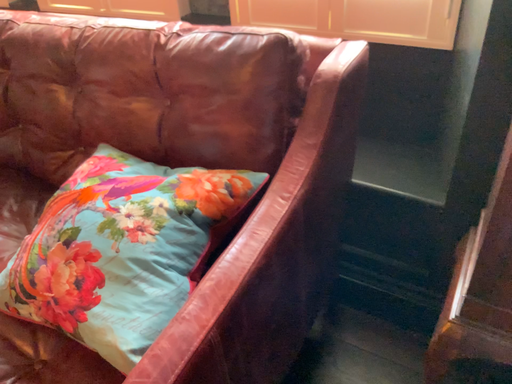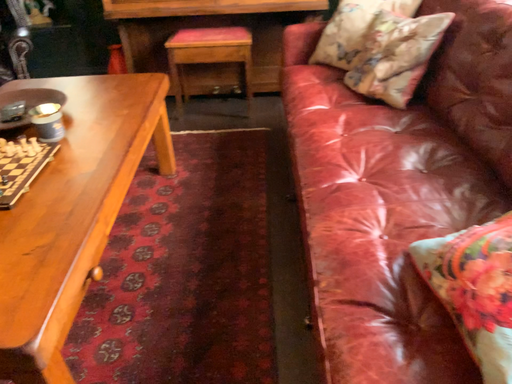
Question: How did the camera likely rotate when shooting the video?

Choices:
 (A) rotated downward
 (B) rotated upward

Answer: (B)